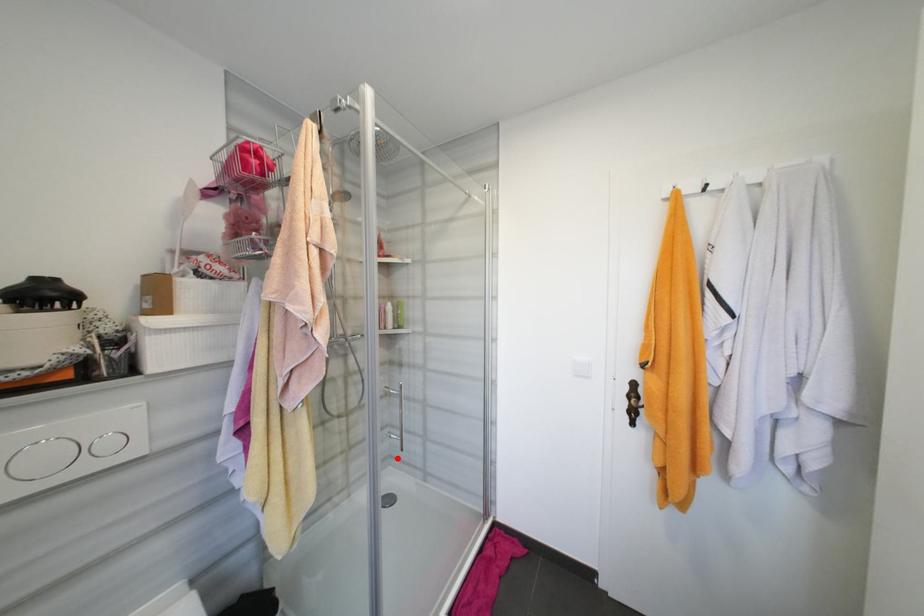
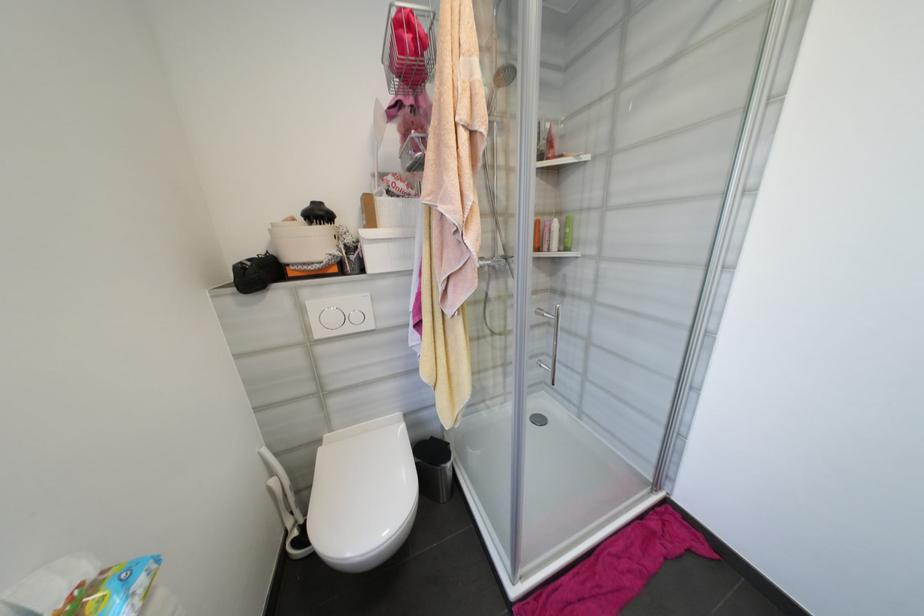
Question: A red point is marked in image1. In image2, is the corresponding 3D point closer to the camera or farther? Reply with the corresponding letter.

Choices:
 (A) The corresponding 3D point is closer.
 (B) The corresponding 3D point is farther.

Answer: (B)